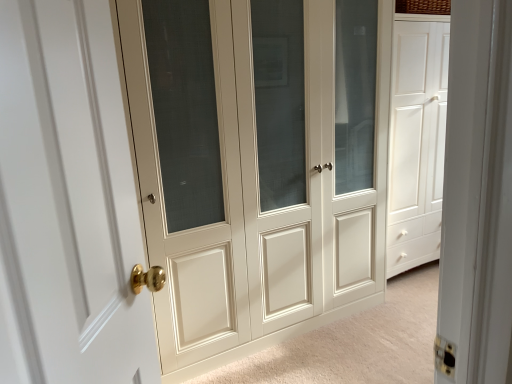
Question: Is white glossy door at left, acting as the second door starting from the right, to the left of matte cream cabinet at center, which is the second door from front to back, from the viewer's perspective?

Choices:
 (A) no
 (B) yes

Answer: (B)

Question: Is white glossy door at left, acting as the second door starting from the right, next to matte cream cabinet at center, which is the second door from front to back?

Choices:
 (A) yes
 (B) no

Answer: (B)

Question: Can you confirm if white glossy door at left, acting as the second door starting from the right, is bigger than matte cream cabinet at center, the second door when ordered from left to right?

Choices:
 (A) no
 (B) yes

Answer: (A)

Question: From the image's perspective, is white glossy door at left, acting as the second door starting from the right, located above matte cream cabinet at center, the second door when ordered from left to right?

Choices:
 (A) no
 (B) yes

Answer: (A)

Question: Is white glossy door at left, the 2th door viewed from the back, to the right of matte cream cabinet at center, which is the first door from back to front, from the viewer's perspective?

Choices:
 (A) yes
 (B) no

Answer: (B)

Question: Does white glossy door at left, acting as the second door starting from the right, have a lesser width compared to matte cream cabinet at center, the second door when ordered from left to right?

Choices:
 (A) yes
 (B) no

Answer: (A)

Question: Does matte cream cabinet at center, which is the 1th door in right-to-left order, contain white glossy door at left, acting as the second door starting from the right?

Choices:
 (A) no
 (B) yes

Answer: (A)

Question: Is white glossy door at left, the 2th door viewed from the back, at the back of matte cream cabinet at center, which is the second door from front to back?

Choices:
 (A) no
 (B) yes

Answer: (A)

Question: Considering the relative sizes of matte cream cabinet at center, the second door when ordered from left to right, and white glossy door at left, the 2th door viewed from the back, in the image provided, is matte cream cabinet at center, the second door when ordered from left to right, wider than white glossy door at left, the 2th door viewed from the back,?

Choices:
 (A) yes
 (B) no

Answer: (A)

Question: From the image's perspective, does matte cream cabinet at center, which is the first door from back to front, appear higher than white glossy door at left, the 2th door viewed from the back?

Choices:
 (A) no
 (B) yes

Answer: (B)

Question: Does matte cream cabinet at center, which is the second door from front to back, have a larger size compared to white glossy door at left, marked as the first door in a front-to-back arrangement?

Choices:
 (A) yes
 (B) no

Answer: (A)

Question: Are matte cream cabinet at center, which is the first door from back to front, and white glossy door at left, the 2th door viewed from the back, far apart?

Choices:
 (A) no
 (B) yes

Answer: (B)

Question: From a real-world perspective, relative to white glossy door at left, acting as the second door starting from the right, is matte cream cabinet at center, which is the first door from back to front, vertically above or below?

Choices:
 (A) below
 (B) above

Answer: (A)